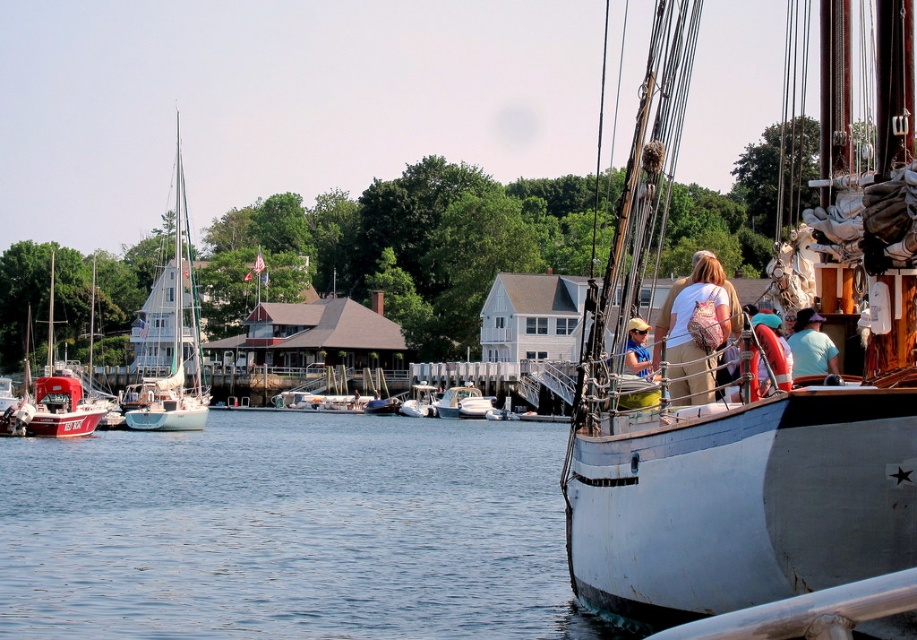
Question: Does clear water at lower left appear under white plastic boat at center?

Choices:
 (A) no
 (B) yes

Answer: (B)

Question: Which is farther from the red matte sailboat at left?

Choices:
 (A) pink backpack at center
 (B) light blue fabric at center
 (C) reflective silver life vest at center
 (D) white matte sailboat at center

Answer: (A)

Question: Does pink backpack at center appear on the left side of light blue fabric at center?

Choices:
 (A) no
 (B) yes

Answer: (B)

Question: Which object is the closest to the pink backpack at center?

Choices:
 (A) white matte sailboat at center
 (B) white glossy sailboat at left

Answer: (A)

Question: Which point is farther to the camera?

Choices:
 (A) (790, 358)
 (B) (443, 404)

Answer: (B)

Question: Is white glossy sailboat at left above pink backpack at center?

Choices:
 (A) yes
 (B) no

Answer: (A)